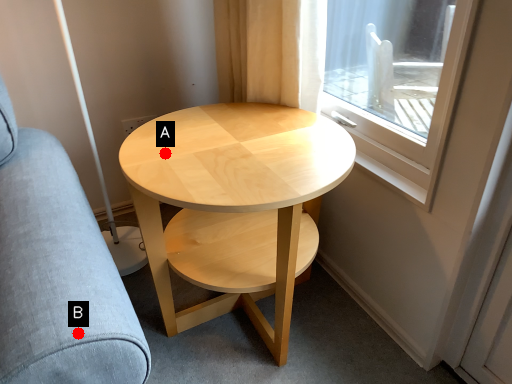
Question: Two points are circled on the image, labeled by A and B beside each circle. Which point is closer to the camera taking this photo?

Choices:
 (A) A is closer
 (B) B is closer

Answer: (B)